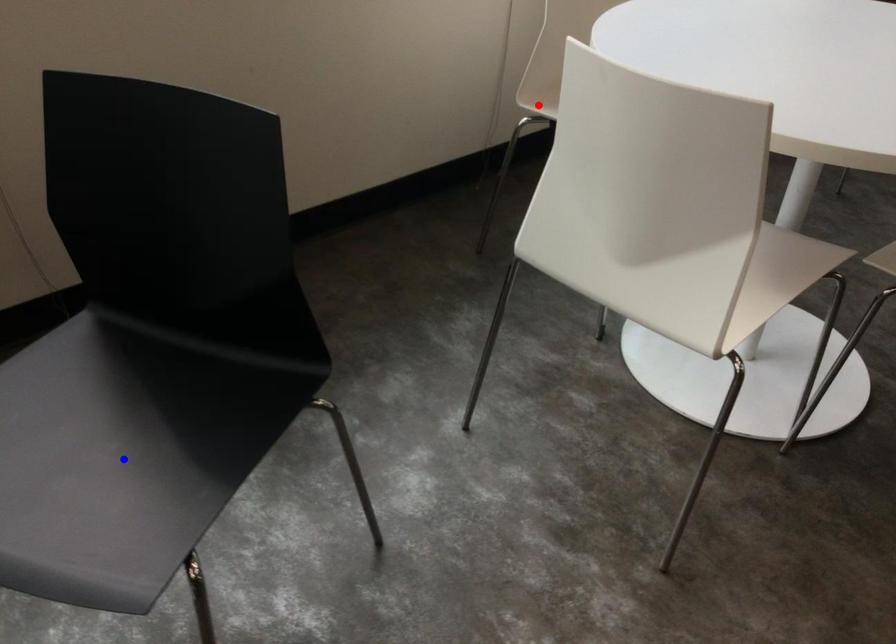
Question: In the image, two points are highlighted. Which point is nearer to the camera? Reply with the corresponding letter.

Choices:
 (A) blue point
 (B) red point

Answer: (A)